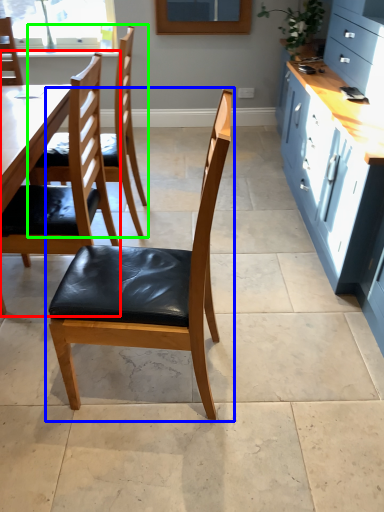
Question: Which object is the farthest from chair (highlighted by a red box)? Choose among these: chair (highlighted by a blue box) or chair (highlighted by a green box).

Choices:
 (A) chair
 (B) chair

Answer: (B)